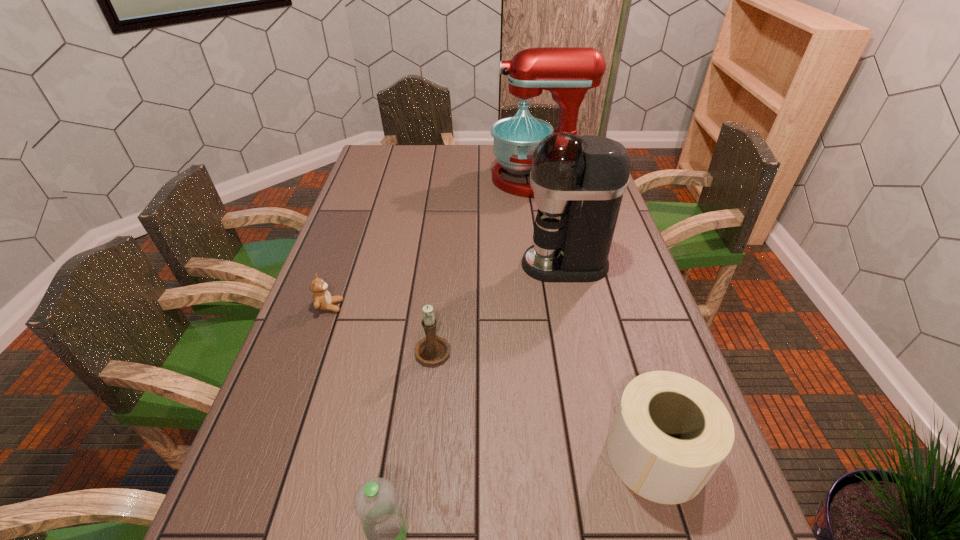
The height and width of the screenshot is (540, 960). Find the location of `free space between the fourth nearest object and the candle holder`. free space between the fourth nearest object and the candle holder is located at coordinates (381, 328).

At what (x,y) coordinates should I click in order to perform the action: click on free area in between the third nearest object and the second farthest object. Please return your answer as a coordinate pair (x, y). Looking at the image, I should click on (499, 307).

Locate an element on the screen. vacant area that lies between the third nearest object and the coffee maker is located at coordinates (499, 307).

Find the location of `vacant space that's between the candle holder and the toilet tissue`. vacant space that's between the candle holder and the toilet tissue is located at coordinates (544, 402).

Identify which object is located as the fourth nearest to the shortest object. Please provide its 2D coordinates. Your answer should be formatted as a tuple, i.e. [(x, y)], where the tuple contains the x and y coordinates of a point satisfying the conditions above.

[(567, 72)]

Identify which object is the fourth nearest to the second nearest object. Please provide its 2D coordinates. Your answer should be formatted as a tuple, i.e. [(x, y)], where the tuple contains the x and y coordinates of a point satisfying the conditions above.

[(322, 300)]

Image resolution: width=960 pixels, height=540 pixels. Find the location of `vacant space that satisfies the following two spatial constraints: 1. on the front-facing side of the fifth farthest object; 2. on the right side of the shortest object`. vacant space that satisfies the following two spatial constraints: 1. on the front-facing side of the fifth farthest object; 2. on the right side of the shortest object is located at coordinates (277, 455).

This screenshot has height=540, width=960. In order to click on vacant region that satisfies the following two spatial constraints: 1. on the front-facing side of the leftmost object; 2. on the side of the candle holder with the handle in this screenshot , I will do `click(315, 349)`.

The width and height of the screenshot is (960, 540). Identify the location of free space that satisfies the following two spatial constraints: 1. on the back side of the toilet tissue; 2. place cup under the spout of the fifth nearest object. (597, 265).

Locate an element on the screen. Image resolution: width=960 pixels, height=540 pixels. free space that satisfies the following two spatial constraints: 1. on the front-facing side of the shortest object; 2. on the back side of the fifth farthest object is located at coordinates (277, 455).